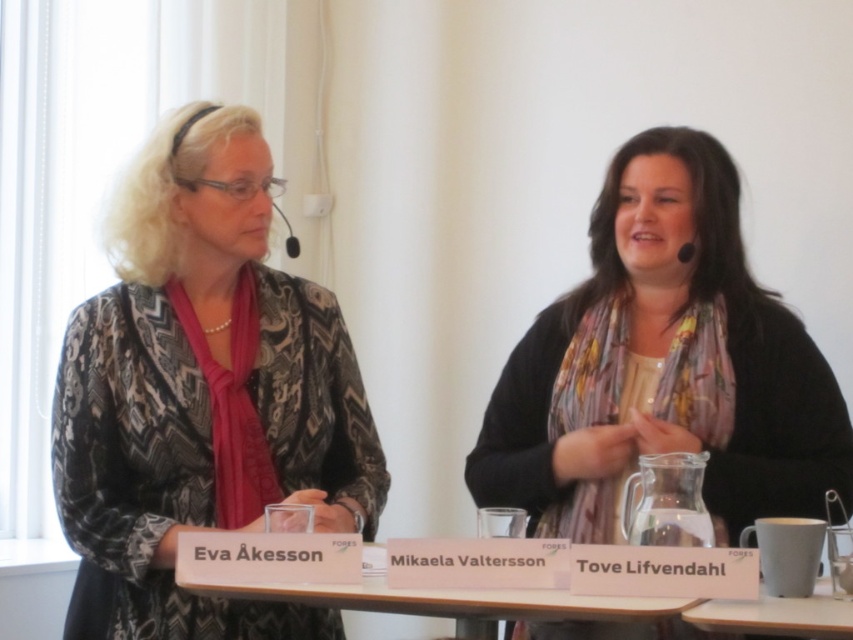
Who is positioned more to the left, patterned fabric jacket at left or floral scarf at center?

patterned fabric jacket at left

Which is in front, point (122, 301) or point (677, 417)?

Point (122, 301)

Is point (229, 173) farther from camera compared to point (613, 384)?

No, it is not.

Image resolution: width=853 pixels, height=640 pixels. I want to click on patterned fabric jacket at left, so click(x=202, y=394).

Which of these two, patterned fabric jacket at left or white paperboard at center, stands taller?

Standing taller between the two is patterned fabric jacket at left.

Is patterned fabric jacket at left further to the viewer compared to white paperboard at center?

Yes, patterned fabric jacket at left is further from the viewer.

Which is in front, point (231, 420) or point (471, 602)?

Point (471, 602) is more forward.

Find the location of a particular element. patterned fabric jacket at left is located at coordinates (202, 394).

Can you confirm if floral scarf at center is positioned above white paperboard at center?

Correct, floral scarf at center is located above white paperboard at center.

Can you confirm if floral scarf at center is taller than white paperboard at center?

Yes.

Who is more distant from viewer, (x=618, y=493) or (x=680, y=605)?

Point (x=618, y=493)

Find the location of a particular element. Image resolution: width=853 pixels, height=640 pixels. floral scarf at center is located at coordinates (663, 364).